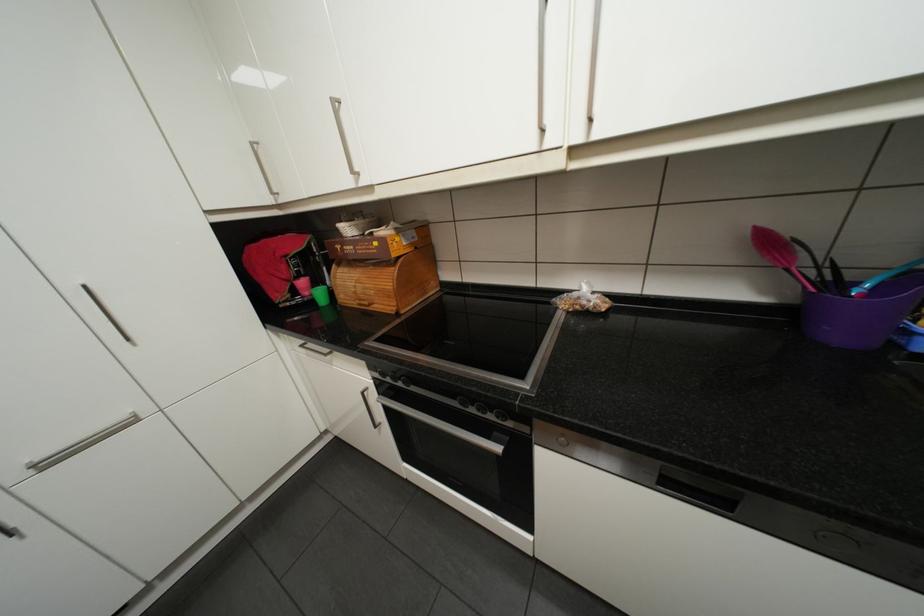
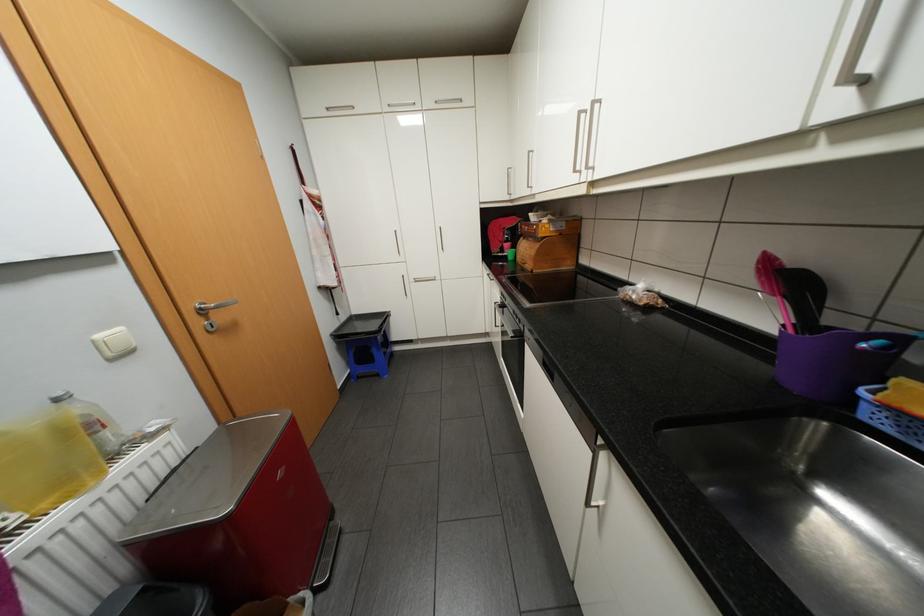
Where in the second image is the point corresponding to (x=346, y=264) from the first image?

(531, 237)